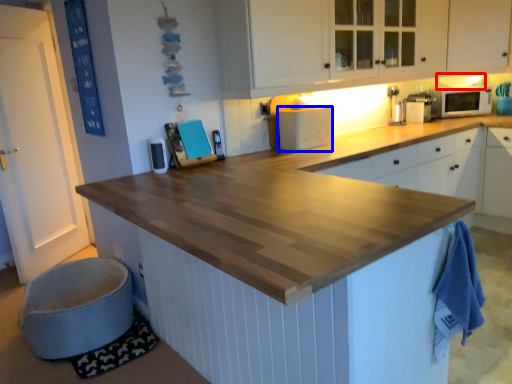
Question: Which point is further to the camera, exhaust hood (highlighted by a red box) or appliance (highlighted by a blue box)?

Choices:
 (A) exhaust hood
 (B) appliance

Answer: (A)